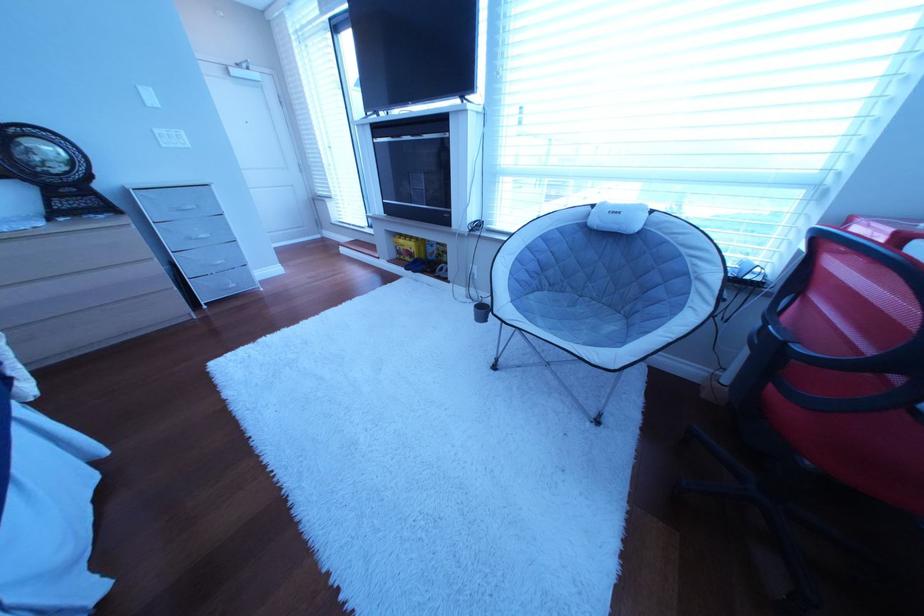
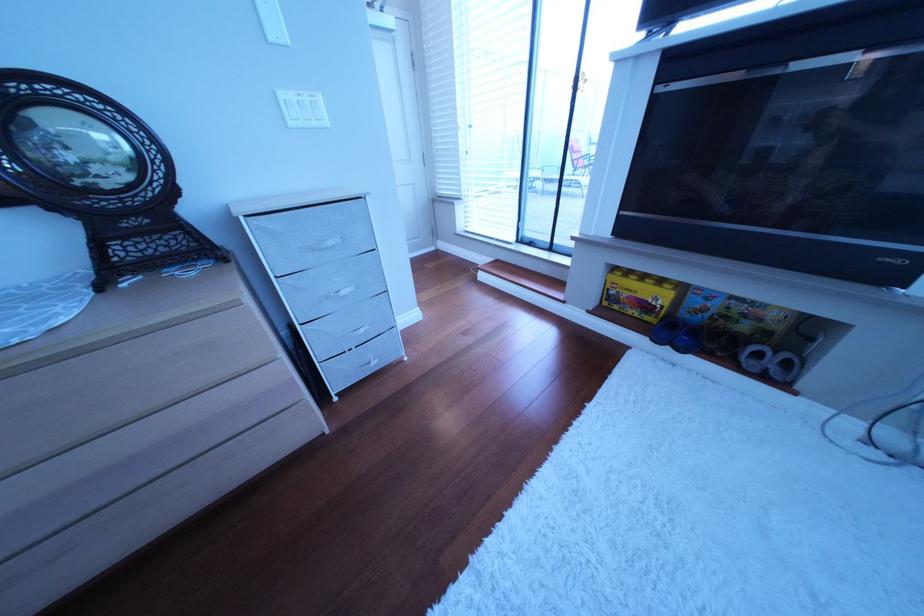
Where in the second image is the point corresponding to the point at 179,148 from the first image?

(307, 126)